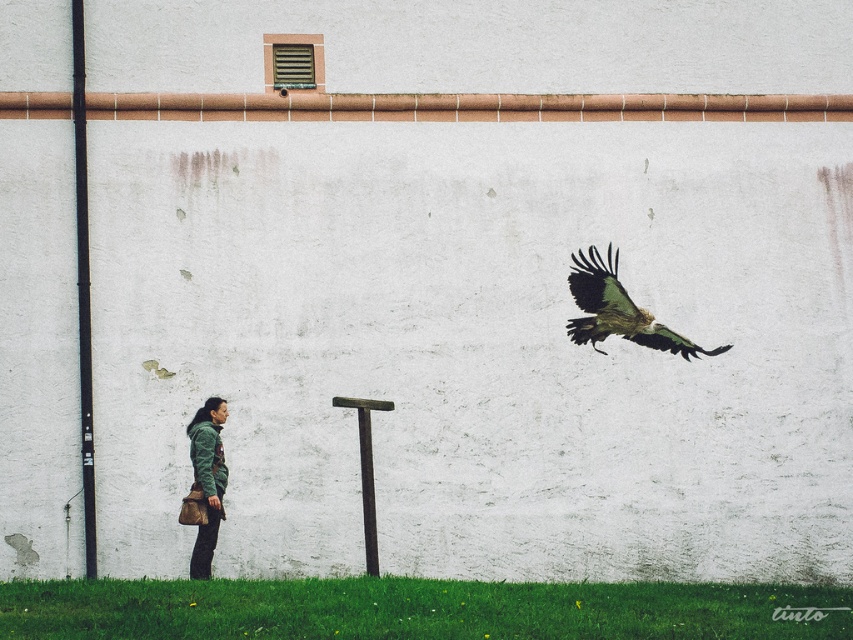
Question: Which point is closer to the camera taking this photo?

Choices:
 (A) (90, 419)
 (B) (372, 486)

Answer: (A)

Question: Can you confirm if green matte jacket at lower left is wider than rusty metal pole at center?

Choices:
 (A) yes
 (B) no

Answer: (B)

Question: Observing the image, what is the correct spatial positioning of greenish-brown textured eagle at upper right in reference to green matte jacket at lower left?

Choices:
 (A) below
 (B) above

Answer: (B)

Question: Which point is farther to the camera?

Choices:
 (A) rusty metal pole at center
 (B) greenish-brown textured eagle at upper right
 (C) green matte jacket at lower left
 (D) black matte pole at left

Answer: (D)

Question: Does black matte pole at left have a lesser width compared to green matte jacket at lower left?

Choices:
 (A) no
 (B) yes

Answer: (A)

Question: Among these objects, which one is nearest to the camera?

Choices:
 (A) rusty metal pole at center
 (B) greenish-brown textured eagle at upper right

Answer: (B)